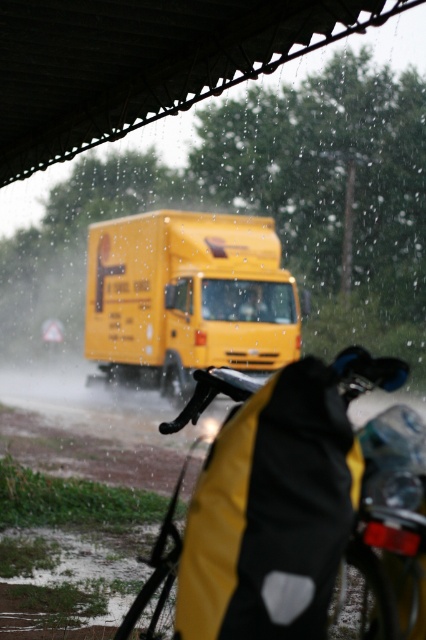
Question: Among these objects, which one is farthest from the camera?

Choices:
 (A) yellow matte bag at lower center
 (B) yellow matte truck at center

Answer: (B)

Question: Can you confirm if yellow matte bag at lower center is wider than yellow matte truck at center?

Choices:
 (A) no
 (B) yes

Answer: (A)

Question: Which point appears farthest from the camera in this image?

Choices:
 (A) coord(187,358)
 (B) coord(232,374)

Answer: (A)

Question: Does yellow matte bag at lower center have a larger size compared to yellow matte truck at center?

Choices:
 (A) yes
 (B) no

Answer: (B)

Question: Is yellow matte bag at lower center smaller than yellow matte truck at center?

Choices:
 (A) no
 (B) yes

Answer: (B)